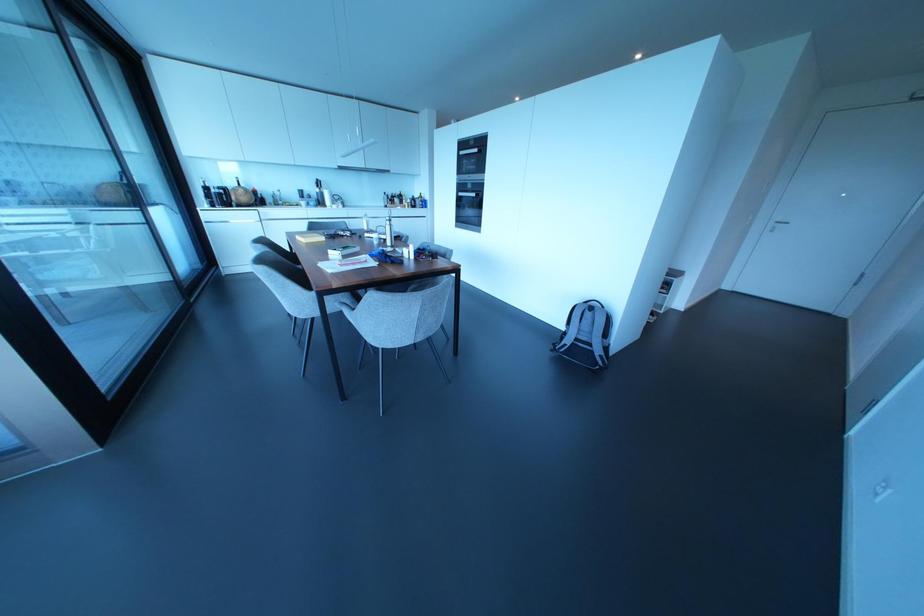
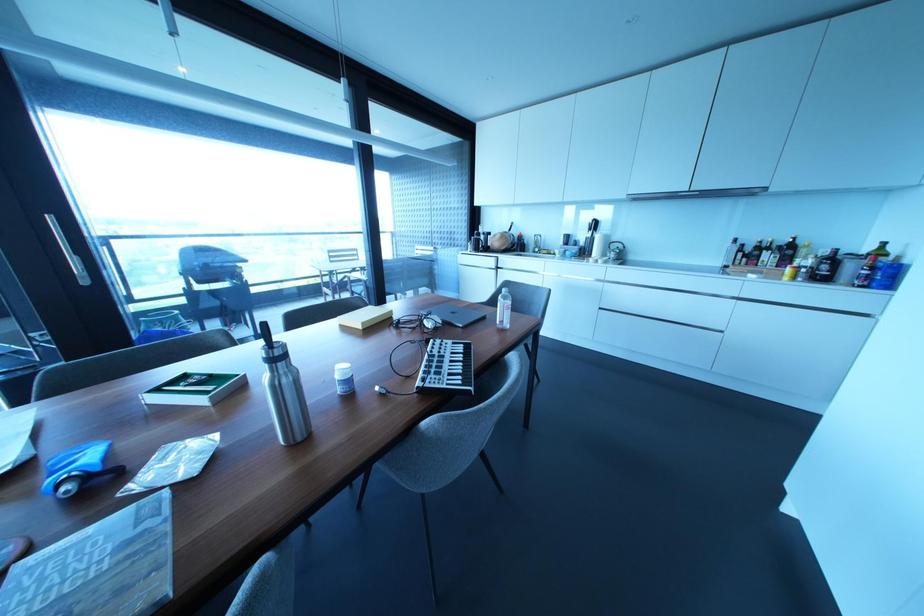
Locate, in the second image, the point that corresponds to [412,199] in the first image.

(833, 257)